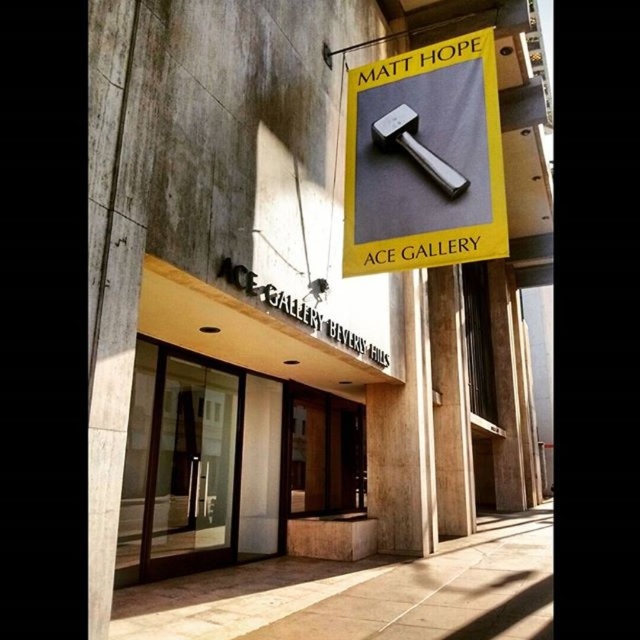
Can you confirm if transparent glass door at center is positioned to the left of polished silver hammer at center?

Yes, transparent glass door at center is to the left of polished silver hammer at center.

Does transparent glass door at center have a lesser width compared to polished silver hammer at center?

Indeed, transparent glass door at center has a lesser width compared to polished silver hammer at center.

Where is `transparent glass door at center`? Image resolution: width=640 pixels, height=640 pixels. transparent glass door at center is located at coordinates (189, 468).

Locate an element on the screen. The image size is (640, 640). transparent glass door at center is located at coordinates point(189,468).

Is metallic hammer at upper center to the left of transparent glass door at center from the viewer's perspective?

Incorrect, metallic hammer at upper center is not on the left side of transparent glass door at center.

Between metallic hammer at upper center and transparent glass door at center, which one has more height?

transparent glass door at center

Does point (451, 243) lie in front of point (209, 486)?

Yes, point (451, 243) is in front of point (209, 486).

The width and height of the screenshot is (640, 640). I want to click on metallic hammer at upper center, so pos(424,160).

Who is positioned more to the left, metallic hammer at upper center or polished silver hammer at center?

metallic hammer at upper center is more to the left.

This screenshot has height=640, width=640. What do you see at coordinates (424, 160) in the screenshot? I see `metallic hammer at upper center` at bounding box center [424, 160].

Find the location of `metallic hammer at upper center`. metallic hammer at upper center is located at coordinates (424, 160).